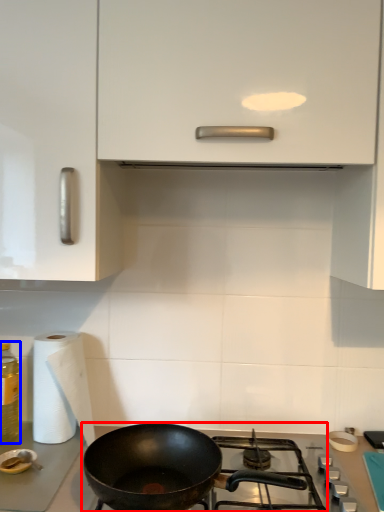
Question: Which object appears closest to the camera in this image, gas stove (highlighted by a red box) or bottle (highlighted by a blue box)?

Choices:
 (A) gas stove
 (B) bottle

Answer: (A)